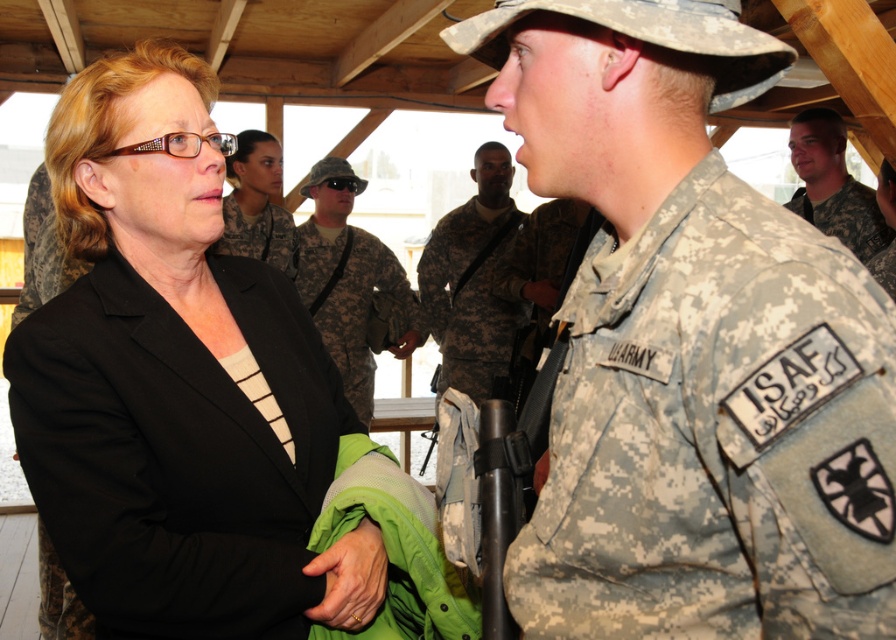
Question: Can you confirm if camouflage uniform at center is positioned to the left of matte black jacket at center?

Choices:
 (A) yes
 (B) no

Answer: (B)

Question: Which of the following is the closest to the observer?

Choices:
 (A) (359, 324)
 (B) (860, 240)

Answer: (B)

Question: Is black matte blazer at left to the right of matte black jacket at center from the viewer's perspective?

Choices:
 (A) no
 (B) yes

Answer: (B)

Question: Among these points, which one is nearest to the camera?

Choices:
 (A) (13, 392)
 (B) (821, 225)
 (C) (276, 230)
 (D) (863, 488)

Answer: (D)

Question: Does black matte blazer at left appear over matte black jacket at center?

Choices:
 (A) no
 (B) yes

Answer: (A)

Question: Which object is positioned farthest from the black matte blazer at left?

Choices:
 (A) camouflage fabric uniform at right
 (B) matte black jacket at center
 (C) camouflage fabric uniform at center

Answer: (C)